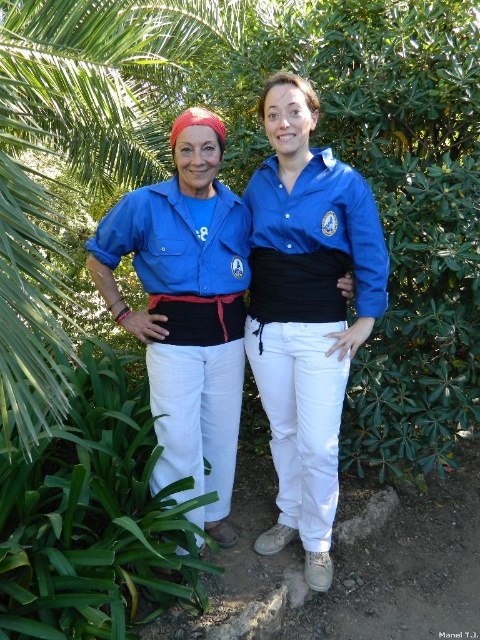
Question: Does green leafy plant at lower left have a greater width compared to blue cotton shirt at center?

Choices:
 (A) yes
 (B) no

Answer: (A)

Question: Is green leafy plant at lower left thinner than blue cotton shirt at center?

Choices:
 (A) yes
 (B) no

Answer: (B)

Question: Can you confirm if blue cotton shirt at center is positioned above matte blue shirt at left?

Choices:
 (A) yes
 (B) no

Answer: (A)

Question: Which of the following is the closest to the observer?

Choices:
 (A) green leafy plant at lower left
 (B) matte blue shirt at left
 (C) blue cotton shirt at center

Answer: (A)

Question: Which is nearer to the blue cotton shirt at center?

Choices:
 (A) matte blue shirt at left
 (B) green leafy plant at lower left

Answer: (A)

Question: Which point appears closest to the camera in this image?

Choices:
 (A) (311, 365)
 (B) (227, 477)
 (C) (4, 461)

Answer: (C)